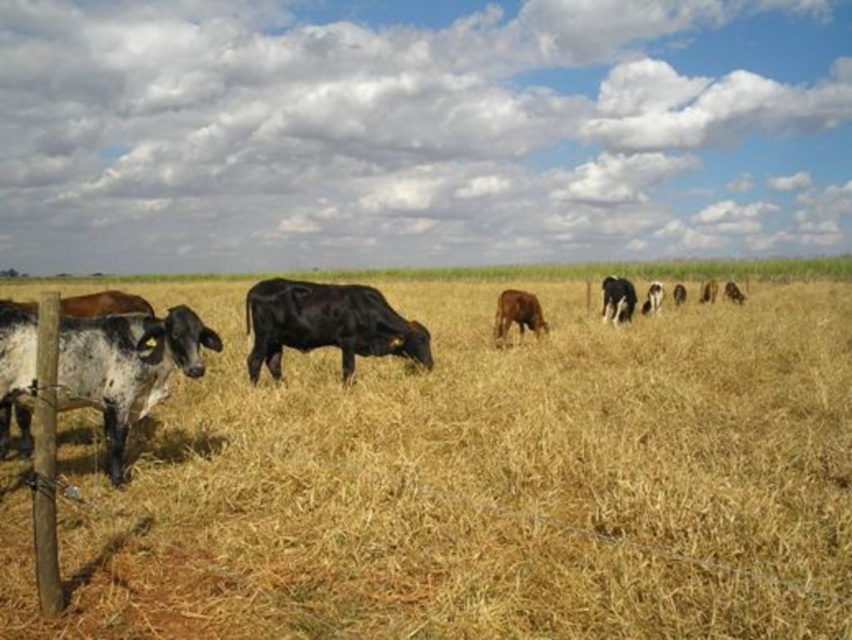
Question: Can you confirm if speckled white/black fur at left is positioned below black smooth cow at center?

Choices:
 (A) no
 (B) yes

Answer: (B)

Question: Can you confirm if black smooth cow at center is positioned below brown matte cow at center?

Choices:
 (A) no
 (B) yes

Answer: (B)

Question: Which is nearer to the brown matte cow at center?

Choices:
 (A) black smooth cow at center
 (B) speckled white/black fur at left
 (C) dry straw at center

Answer: (A)

Question: Can you confirm if black smooth cow at center is positioned to the right of brown matte cow at center?

Choices:
 (A) yes
 (B) no

Answer: (B)

Question: Among these points, which one is farthest from the camera?

Choices:
 (A) (134, 372)
 (B) (528, 326)
 (C) (301, 538)

Answer: (B)

Question: Which object is positioned farthest from the brown matte cow at center?

Choices:
 (A) dry straw at center
 (B) speckled white/black fur at left

Answer: (B)